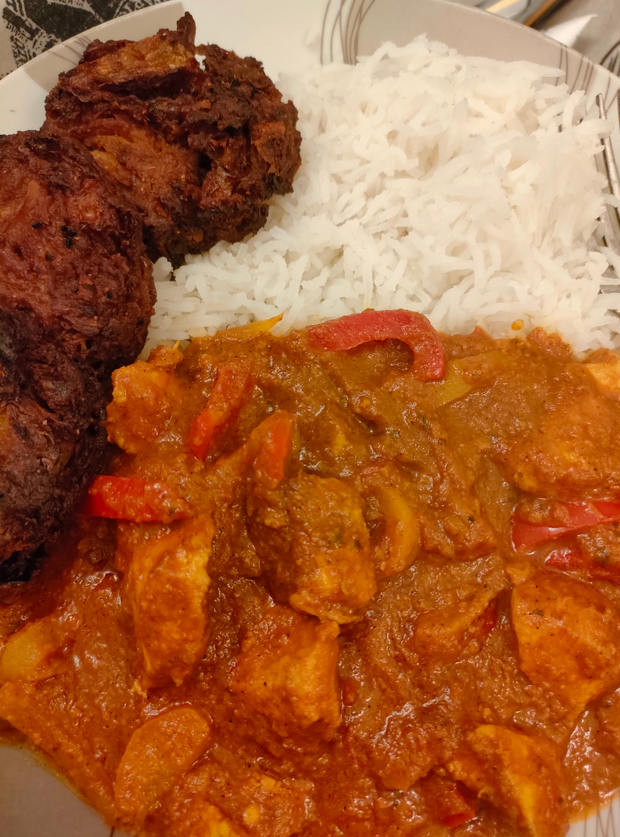
This screenshot has width=620, height=837. Find the location of `white bowl`. white bowl is located at coordinates (472, 31).